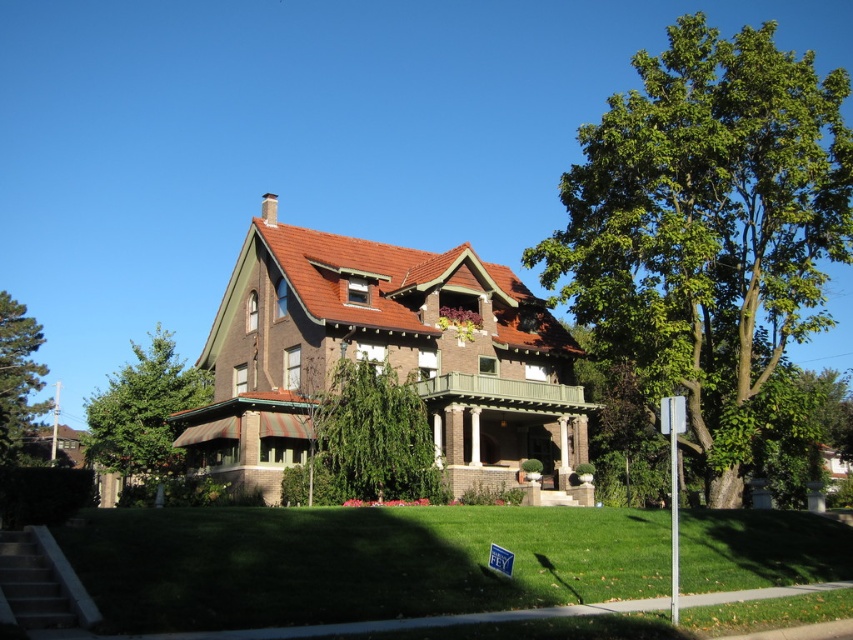
Who is positioned more to the right, green leafy tree at upper right or green leafy tree at left?

green leafy tree at upper right

Does green leafy tree at upper right appear over green leafy tree at left?

Indeed, green leafy tree at upper right is positioned over green leafy tree at left.

Where is `green leafy tree at upper right`? The image size is (853, 640). green leafy tree at upper right is located at coordinates (708, 225).

In the scene shown: Which of these two, green leafy tree at upper right or green leafy tree at center, stands taller?

green leafy tree at upper right is taller.

Who is shorter, green leafy tree at upper right or green leafy tree at center?

Standing shorter between the two is green leafy tree at center.

Who is more forward, (811, 166) or (409, 396)?

Point (409, 396) is more forward.

I want to click on green leafy tree at upper right, so point(708,225).

Is green leafy tree at center smaller than green pine tree at left?

Correct, green leafy tree at center occupies less space than green pine tree at left.

Can you confirm if green leafy tree at center is taller than green pine tree at left?

No.

Which is behind, point (380, 465) or point (13, 442)?

The point (13, 442) is behind.

At what (x,y) coordinates should I click in order to perform the action: click on green leafy tree at center. Please return your answer as a coordinate pair (x, y). Looking at the image, I should click on (374, 436).